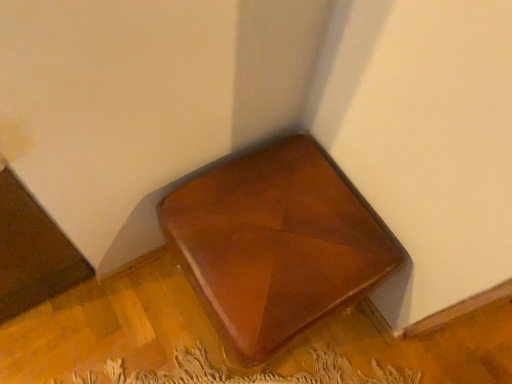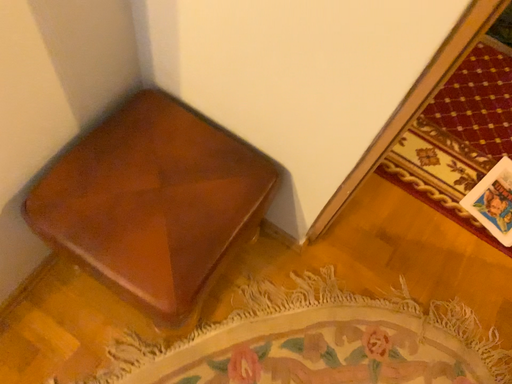
Question: Which way did the camera rotate in the video?

Choices:
 (A) rotated right
 (B) rotated left

Answer: (A)